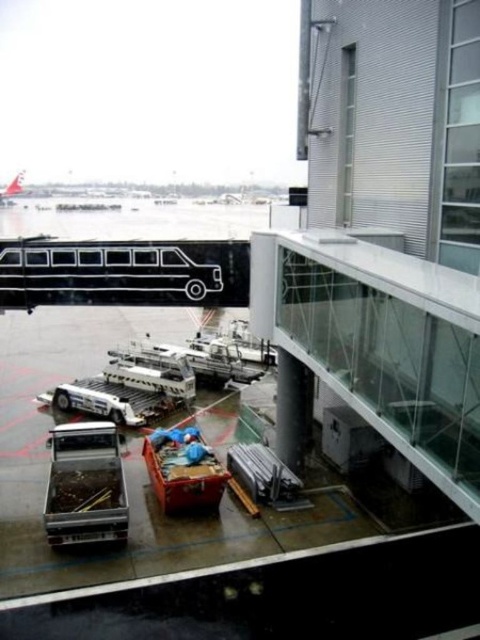
Measure the distance between point (140, 301) and camera.

62.39 feet

What do you see at coordinates (108, 273) in the screenshot? This screenshot has width=480, height=640. I see `black matte bus at upper left` at bounding box center [108, 273].

Who is more distant from viewer, (222, 268) or (104, 458)?

Positioned behind is point (222, 268).

The image size is (480, 640). I want to click on black matte bus at upper left, so click(x=108, y=273).

In the scene shown: Is the position of black matte bus at upper left more distant than that of white glossy airplane at upper left?

That is False.

Describe the element at coordinates (108, 273) in the screenshot. I see `black matte bus at upper left` at that location.

Does point (214, 292) come in front of point (9, 202)?

Yes.

You are a GUI agent. You are given a task and a screenshot of the screen. Output one action in this format:
    pyautogui.click(x=<x>, y=<y>)
    Task: Click on the black matte bus at upper left
    The height and width of the screenshot is (640, 480).
    Given the screenshot: What is the action you would take?
    pyautogui.click(x=108, y=273)

From the picture: Who is taller, metallic silver bus at lower left or white glossy airplane at upper left?

white glossy airplane at upper left is taller.

Is metallic silver bus at lower left taller than white glossy airplane at upper left?

No, metallic silver bus at lower left is not taller than white glossy airplane at upper left.

Does point (106, 506) come closer to viewer compared to point (8, 202)?

Yes, it is in front of point (8, 202).

Locate an element on the screen. The image size is (480, 640). metallic silver bus at lower left is located at coordinates (85, 484).